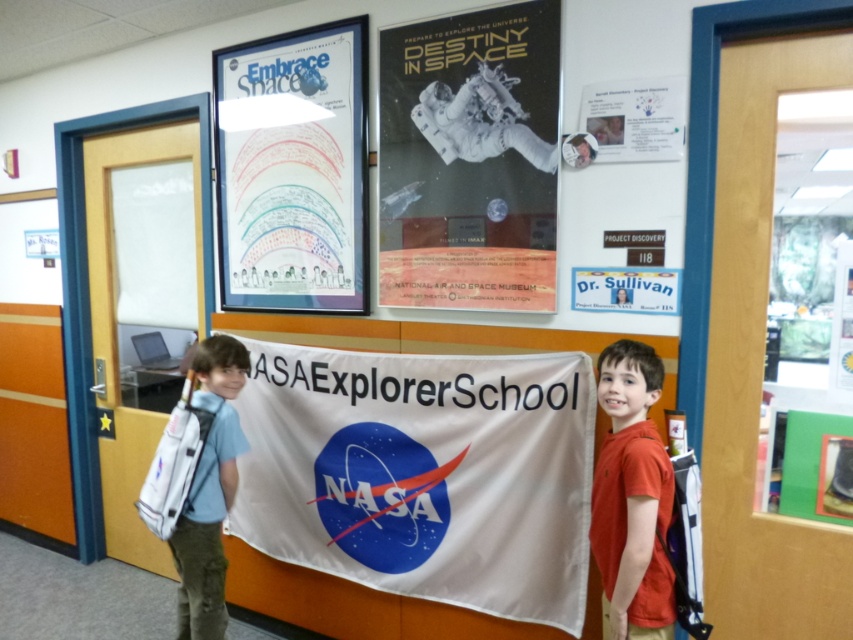
Question: Which is nearer to the orange matte shirt at right?

Choices:
 (A) white fabric banner at center
 (B) light blue fabric backpack at left
 (C) matte black poster at upper center

Answer: (A)

Question: Can you confirm if colored paper rainbow at upper left is bigger than orange matte shirt at right?

Choices:
 (A) no
 (B) yes

Answer: (B)

Question: Which of the following is the farthest from the observer?

Choices:
 (A) (466, 243)
 (B) (252, 449)

Answer: (B)

Question: Is colored paper rainbow at upper left closer to camera compared to white paper at upper center?

Choices:
 (A) no
 (B) yes

Answer: (A)

Question: Which of these objects is positioned farthest from the orange matte shirt at right?

Choices:
 (A) white paper at upper right
 (B) colored paper rainbow at upper left
 (C) white paper at upper center

Answer: (B)

Question: Is matte black poster at upper center above white paper at upper right?

Choices:
 (A) yes
 (B) no

Answer: (B)